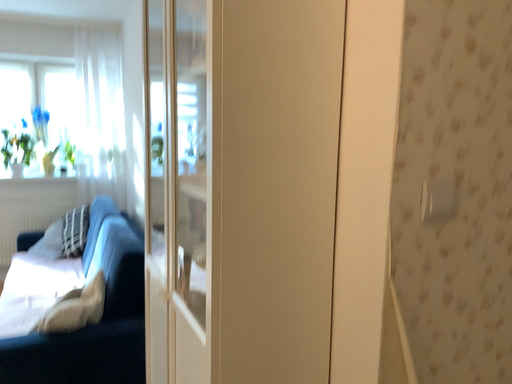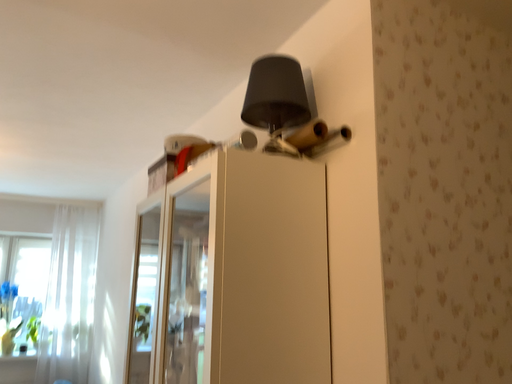
Question: Which way did the camera rotate in the video?

Choices:
 (A) rotated downward
 (B) rotated upward

Answer: (B)